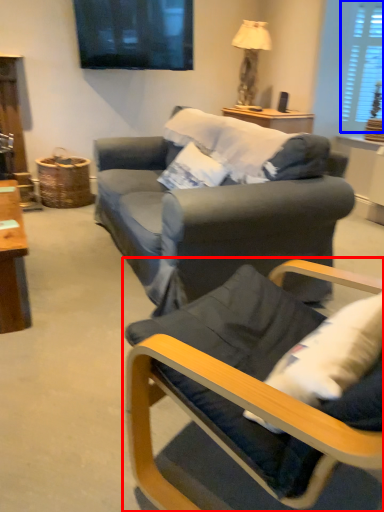
Question: Which object appears closest to the camera in this image, chair (highlighted by a red box) or window (highlighted by a blue box)?

Choices:
 (A) chair
 (B) window

Answer: (A)